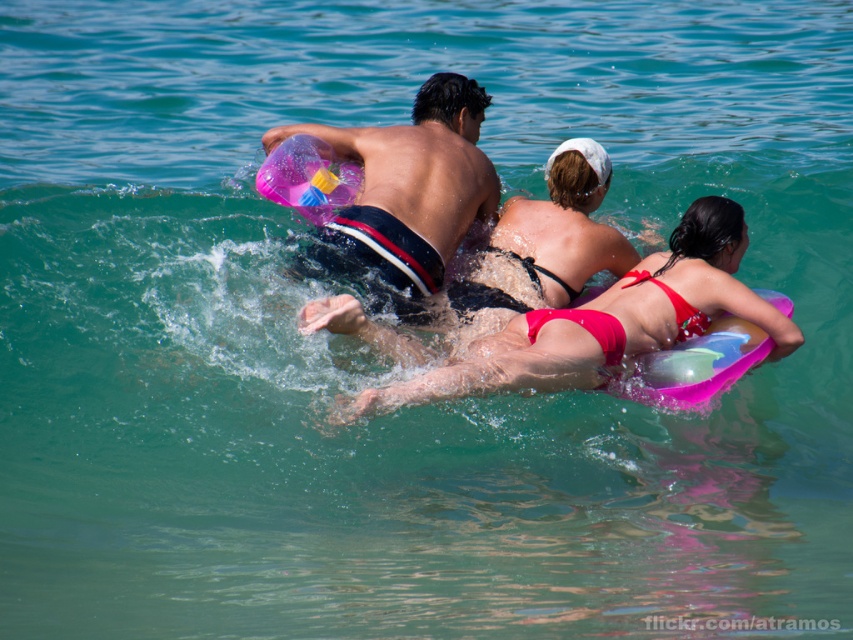
Does matte pink bikini at center appear on the left side of matte black bikini at center?

Yes, matte pink bikini at center is to the left of matte black bikini at center.

Is matte pink bikini at center wider than matte black bikini at center?

In fact, matte pink bikini at center might be narrower than matte black bikini at center.

What do you see at coordinates (607, 321) in the screenshot?
I see `matte pink bikini at center` at bounding box center [607, 321].

What are the coordinates of `matte pink bikini at center` in the screenshot? It's located at (607, 321).

Can you confirm if pink rubber ball at center is taller than matte black bikini at center?

Yes.

Which is more to the right, pink rubber ball at center or matte black bikini at center?

From the viewer's perspective, matte black bikini at center appears more on the right side.

Who is more distant from viewer, (421, 214) or (606, 268)?

The point (421, 214) is behind.

You are a GUI agent. You are given a task and a screenshot of the screen. Output one action in this format:
    pyautogui.click(x=<x>, y=<y>)
    Task: Click on the pink rubber ball at center
    
    Given the screenshot: What is the action you would take?
    pyautogui.click(x=407, y=195)

Between matte pink bikini at center and pink rubber ball at center, which one is positioned higher?

pink rubber ball at center

Who is positioned more to the right, matte pink bikini at center or pink rubber ball at center?

From the viewer's perspective, matte pink bikini at center appears more on the right side.

Does point (450, 396) come closer to viewer compared to point (350, 256)?

That is True.

The width and height of the screenshot is (853, 640). I want to click on matte pink bikini at center, so click(x=607, y=321).